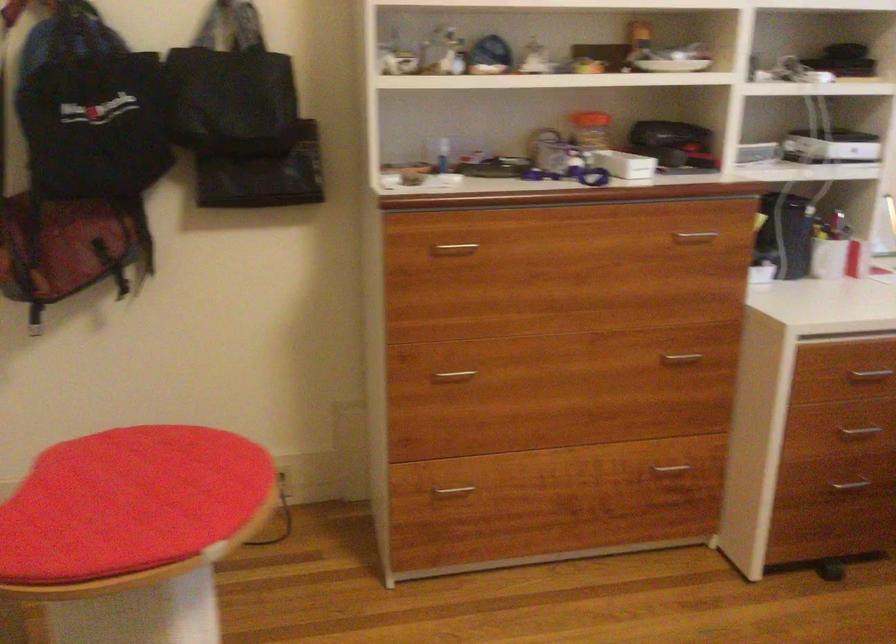
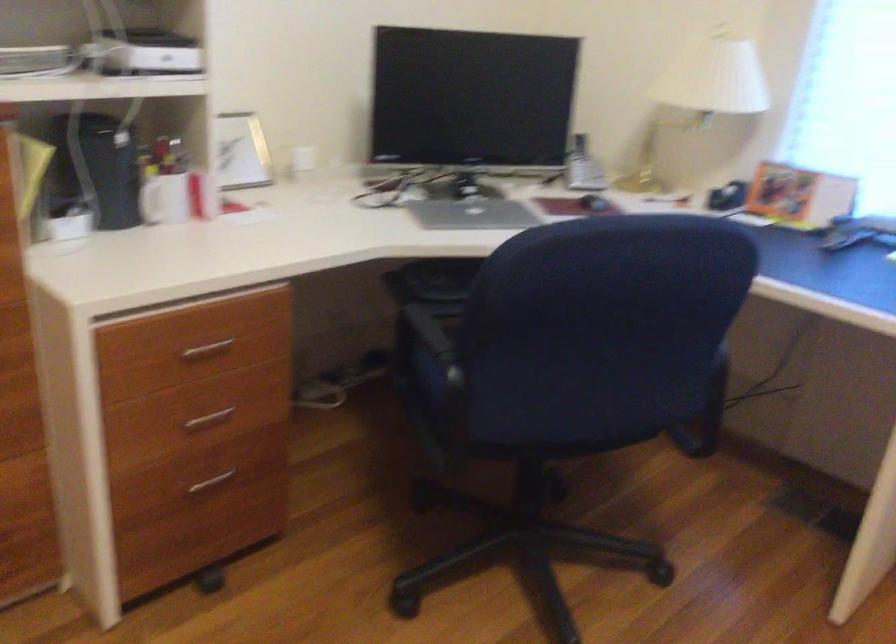
Question: The first image is from the beginning of the video and the second image is from the end. How did the camera likely rotate when shooting the video?

Choices:
 (A) Left
 (B) Right
 (C) Up
 (D) Down

Answer: (B)